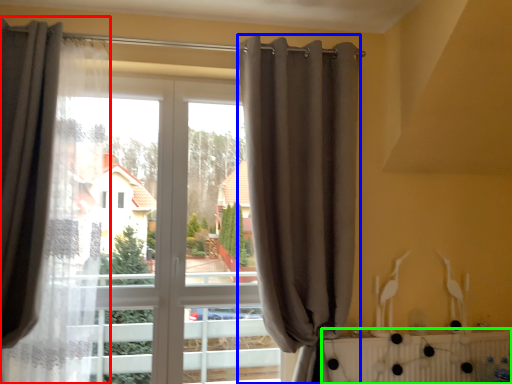
Question: Which is nearer to the curtain (highlighted by a red box)? curtain (highlighted by a blue box) or radiator (highlighted by a green box).

Choices:
 (A) curtain
 (B) radiator

Answer: (A)